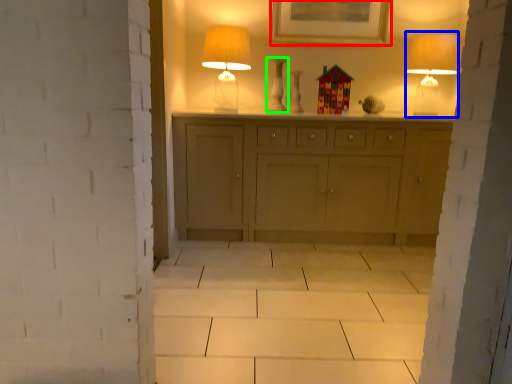
Question: Based on their relative distances, which object is nearer to picture frame (highlighted by a red box)? Choose from table lamp (highlighted by a blue box) and vase (highlighted by a green box).

Choices:
 (A) table lamp
 (B) vase

Answer: (B)